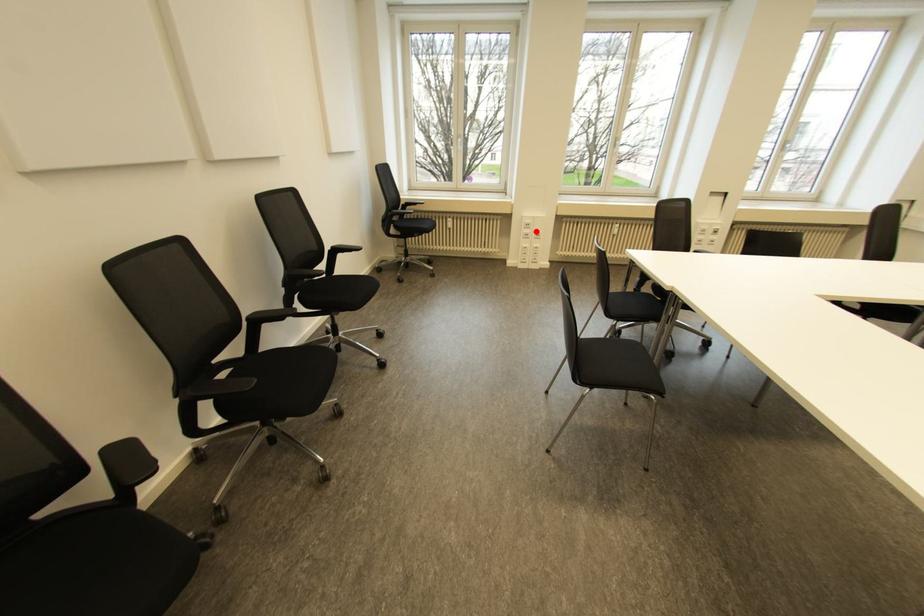
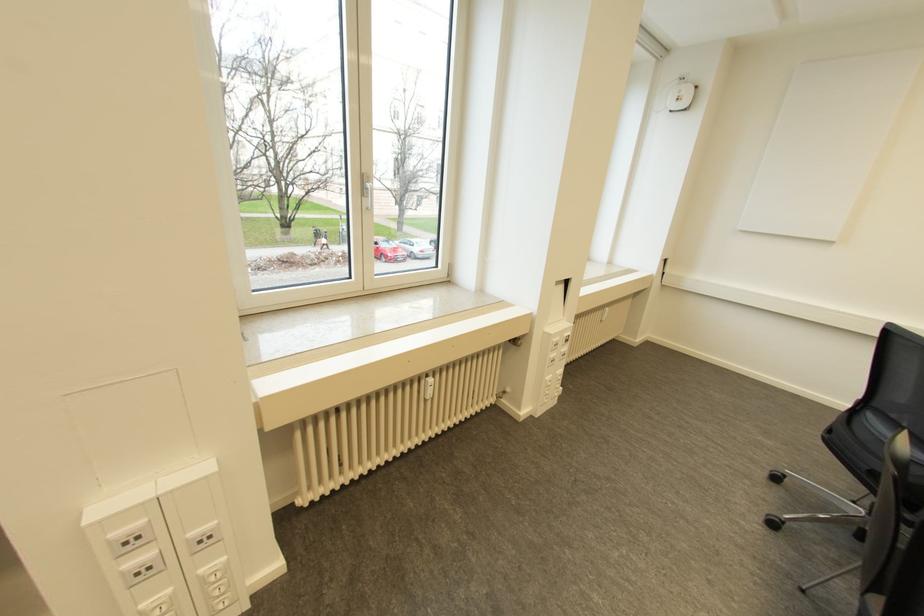
Where in the second image is the point corresponding to the highlighted location from the first image?

(197, 531)